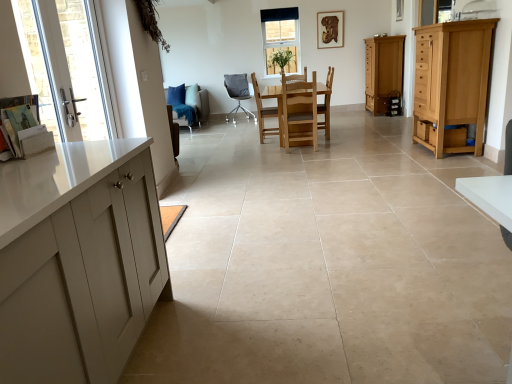
This screenshot has height=384, width=512. Describe the element at coordinates (280, 38) in the screenshot. I see `wooden frame window at upper center` at that location.

Locate an element on the screen. The height and width of the screenshot is (384, 512). wooden drawer at lower right, the first drawer from the left is located at coordinates (423, 129).

Describe the element at coordinates (423, 129) in the screenshot. I see `wooden drawer at lower right, acting as the 1th drawer starting from the front` at that location.

What are the coordinates of `wooden chair at center, the 1th chair from the right` in the screenshot? It's located at (326, 104).

What do you see at coordinates (426, 81) in the screenshot? This screenshot has width=512, height=384. I see `light wood drawer at right, the 2th drawer positioned from the left` at bounding box center [426, 81].

Where is `light wood drawer at right, which is the first drawer in right-to-left order`? light wood drawer at right, which is the first drawer in right-to-left order is located at coordinates (426, 81).

Locate an element on the screen. The image size is (512, 384). suede-like beige chair at left, which ranks as the 1th chair in left-to-right order is located at coordinates (198, 103).

Can you confirm if wooden frame window at upper center is positioned to the right of clear glass door at left?

Yes, wooden frame window at upper center is to the right of clear glass door at left.

Is point (268, 66) closer or farther from the camera than point (98, 127)?

Point (268, 66) is positioned farther from the camera compared to point (98, 127).

Is wooden frame window at upper center inside or outside of clear glass door at left?

wooden frame window at upper center exists outside the volume of clear glass door at left.

Locate an element on the screen. This screenshot has width=512, height=384. glass door below the wooden frame window at upper center (from a real-world perspective) is located at coordinates (64, 59).

Which of these two, wooden chair at center, the 1th chair from the right, or light brown wooden chair at center, placed as the 2th chair when sorted from right to left, is bigger?

Bigger between the two is light brown wooden chair at center, placed as the 2th chair when sorted from right to left.

From the image's perspective, between wooden chair at center, the 1th chair from the right, and light brown wooden chair at center, placed as the 2th chair when sorted from right to left, who is located below?

light brown wooden chair at center, placed as the 2th chair when sorted from right to left, appears lower in the image.

Considering the relative sizes of wooden chair at center, the 5th chair positioned from the left, and light brown wooden chair at center, acting as the fourth chair starting from the left, in the image provided, is wooden chair at center, the 5th chair positioned from the left, thinner than light brown wooden chair at center, acting as the fourth chair starting from the left,?

Yes, wooden chair at center, the 5th chair positioned from the left, is thinner than light brown wooden chair at center, acting as the fourth chair starting from the left.

Considering the sizes of wooden chair at center, the 1th chair from the right, and light brown wooden chair at center, placed as the 2th chair when sorted from right to left, in the image, is wooden chair at center, the 1th chair from the right, taller or shorter than light brown wooden chair at center, placed as the 2th chair when sorted from right to left,?

Considering their sizes, wooden chair at center, the 1th chair from the right, has more height than light brown wooden chair at center, placed as the 2th chair when sorted from right to left.

From the picture: Visually, is matte gray chair at center, which is counted as the fourth chair, starting from the right, positioned to the left or to the right of wooden frame window at upper center?

matte gray chair at center, which is counted as the fourth chair, starting from the right, is positioned on wooden frame window at upper center's left side.

Which is nearer, (229, 85) or (288, 24)?

Positioned in front is point (229, 85).

Is matte gray chair at center, positioned as the second chair in left-to-right order, next to wooden frame window at upper center?

matte gray chair at center, positioned as the second chair in left-to-right order, and wooden frame window at upper center are not in contact.

Between matte gray chair at center, which is counted as the fourth chair, starting from the right, and wooden frame window at upper center, which one has smaller size?

Smaller between the two is wooden frame window at upper center.

Based on the photo, from a real-world perspective, which object stands above the other?

From a 3D spatial view, wooden frame window at upper center is above.

Does wooden chair at center, which is the third chair from left to right, have a greater height compared to wooden frame window at upper center?

No, wooden chair at center, which is the third chair from left to right, is not taller than wooden frame window at upper center.

How many degrees apart are the facing directions of wooden chair at center, which is the third chair from left to right, and wooden frame window at upper center?

They differ by 89.8 degrees in their facing directions.

Considering the sizes of wooden chair at center, acting as the third chair starting from the right, and wooden frame window at upper center in the image, is wooden chair at center, acting as the third chair starting from the right, wider or thinner than wooden frame window at upper center?

wooden chair at center, acting as the third chair starting from the right, is wider than wooden frame window at upper center.

Which of these two, light wood drawer at right, the 2th drawer positioned from the left, or wooden chair at center, which is the third chair from left to right, is wider?

With larger width is wooden chair at center, which is the third chair from left to right.

Locate an element on the screen. The height and width of the screenshot is (384, 512). the 1st chair in front of the light wood drawer at right, the 2th drawer positioned from the left is located at coordinates (263, 112).

Does point (423, 119) come farther from viewer compared to point (257, 102)?

No, it is not.

Starting from the suede-like beige chair at left, the fifth chair positioned from the right, which chair is the 2nd one to the right? Please provide its 2D coordinates.

[(263, 112)]

Is wooden chair at center, acting as the third chair starting from the right, surrounding suede-like beige chair at left, the fifth chair positioned from the right?

No, suede-like beige chair at left, the fifth chair positioned from the right, is not surrounded by wooden chair at center, acting as the third chair starting from the right.

Could you tell me if wooden chair at center, acting as the third chair starting from the right, is turned towards suede-like beige chair at left, which ranks as the 1th chair in left-to-right order?

No, wooden chair at center, acting as the third chair starting from the right, does not turn towards suede-like beige chair at left, which ranks as the 1th chair in left-to-right order.

From the image's perspective, between wooden chair at center, acting as the third chair starting from the right, and suede-like beige chair at left, the fifth chair positioned from the right, which one is located above?

suede-like beige chair at left, the fifth chair positioned from the right, is shown above in the image.

From the image's perspective, is light brown wood cabinet at right, the 1th cabinetry when ordered from front to back, below matte wooden cabinet at right, the 1th cabinetry in the back-to-front sequence?

Indeed, from the image's perspective, light brown wood cabinet at right, the 1th cabinetry when ordered from front to back, is shown beneath matte wooden cabinet at right, the 1th cabinetry in the back-to-front sequence.

At what (x,y) coordinates should I click in order to perform the action: click on cabinetry below the light brown wood cabinet at right, arranged as the 2th cabinetry when viewed from the back (from a real-world perspective). Please return your answer as a coordinate pair (x, y). The width and height of the screenshot is (512, 384). Looking at the image, I should click on (383, 71).

Can you confirm if light brown wood cabinet at right, arranged as the 2th cabinetry when viewed from the back, is thinner than matte wooden cabinet at right, the 1th cabinetry in the back-to-front sequence?

No.

Between light brown wood cabinet at right, arranged as the 2th cabinetry when viewed from the back, and matte wooden cabinet at right, the 1th cabinetry in the back-to-front sequence, which one appears on the right side from the viewer's perspective?

matte wooden cabinet at right, the 1th cabinetry in the back-to-front sequence, is more to the right.

Where is `glass door on the left of wooden frame window at upper center`? The height and width of the screenshot is (384, 512). glass door on the left of wooden frame window at upper center is located at coordinates (64, 59).

Image resolution: width=512 pixels, height=384 pixels. Find the location of `chair in front of the wooden chair at center, the 1th chair from the right`. chair in front of the wooden chair at center, the 1th chair from the right is located at coordinates (264, 113).

Estimate the real-world distances between objects in this image. Which object is closer to light wood drawer at right, which is the first drawer in right-to-left order, light brown wood cabinet at right, the 1th cabinetry when ordered from front to back, or suede-like beige chair at left, the fifth chair positioned from the right?

Based on the image, light brown wood cabinet at right, the 1th cabinetry when ordered from front to back, appears to be nearer to light wood drawer at right, which is the first drawer in right-to-left order.

Considering their positions, is wooden picture frame at upper center positioned closer to light wood drawer at right, which is the first drawer in right-to-left order, than suede-like beige chair at left, the fifth chair positioned from the right?

suede-like beige chair at left, the fifth chair positioned from the right, lies closer to light wood drawer at right, which is the first drawer in right-to-left order, than the other object.

Based on their spatial positions, is wooden chair at center, acting as the third chair starting from the right, or clear glass door at left closer to light wood drawer at right, the 2th drawer positioned from the left?

Among the two, wooden chair at center, acting as the third chair starting from the right, is located nearer to light wood drawer at right, the 2th drawer positioned from the left.

Looking at the image, which one is located closer to wooden frame window at upper center, wooden chair at center, which is the third chair from left to right, or suede-like beige chair at left, which ranks as the 1th chair in left-to-right order?

wooden chair at center, which is the third chair from left to right, is closer to wooden frame window at upper center.

Based on the photo, from the image, which object appears to be nearer to clear glass door at left, wooden drawer at lower right, the 1th drawer from the bottom, or matte wooden cabinet at right, which is the 2th cabinetry in front-to-back order?

wooden drawer at lower right, the 1th drawer from the bottom.

Considering their positions, is wooden picture frame at upper center positioned closer to clear glass door at left than wooden chair at center, which is the third chair from left to right?

wooden chair at center, which is the third chair from left to right.

When comparing their distances from matte wooden cabinet at right, which is the 2th cabinetry in front-to-back order, does light brown wood cabinet at right, arranged as the 2th cabinetry when viewed from the back, or wooden frame window at upper center seem further?

Among the two, light brown wood cabinet at right, arranged as the 2th cabinetry when viewed from the back, is located further to matte wooden cabinet at right, which is the 2th cabinetry in front-to-back order.

Consider the image. Which object lies further to the anchor point wooden frame window at upper center, light brown wood cabinet at right, arranged as the 2th cabinetry when viewed from the back, or matte gray chair at center, which is counted as the fourth chair, starting from the right?

light brown wood cabinet at right, arranged as the 2th cabinetry when viewed from the back, lies further to wooden frame window at upper center than the other object.

Where is `chair between wooden chair at center, which is the third chair from left to right, and matte gray chair at center, positioned as the second chair in left-to-right order, in the front-back direction`? chair between wooden chair at center, which is the third chair from left to right, and matte gray chair at center, positioned as the second chair in left-to-right order, in the front-back direction is located at coordinates (198, 103).

Where is `picture frame located between wooden frame window at upper center and matte wooden cabinet at right, which is the 2th cabinetry in front-to-back order, in the left-right direction`? This screenshot has height=384, width=512. picture frame located between wooden frame window at upper center and matte wooden cabinet at right, which is the 2th cabinetry in front-to-back order, in the left-right direction is located at coordinates (330, 29).

Locate an element on the screen. Image resolution: width=512 pixels, height=384 pixels. chair between light brown wooden chair at center, placed as the 2th chair when sorted from right to left, and wooden drawer at lower right, the first drawer from the left, in the horizontal direction is located at coordinates (326, 104).

Find the location of `drawer located between wooden chair at center, the 1th chair from the right, and wooden picture frame at upper center in the depth direction`. drawer located between wooden chair at center, the 1th chair from the right, and wooden picture frame at upper center in the depth direction is located at coordinates (426, 81).